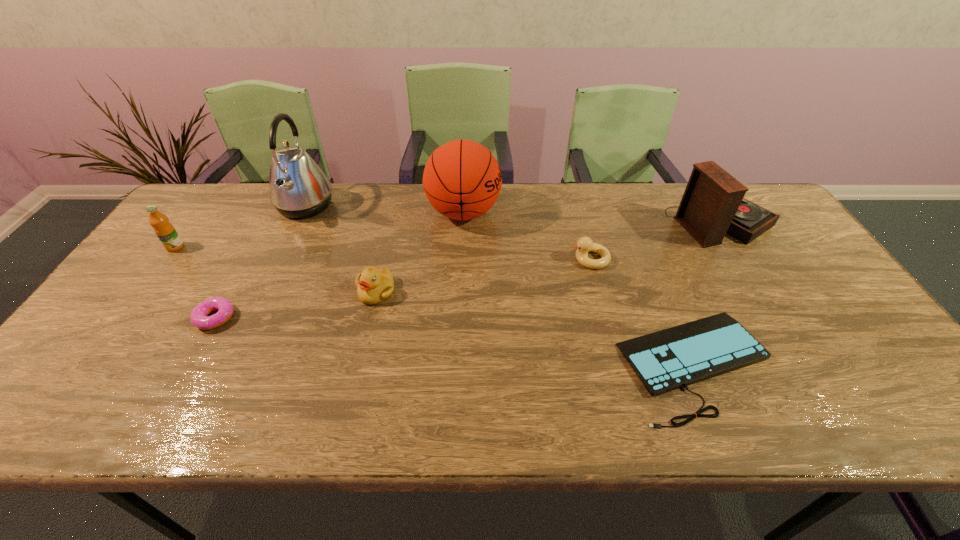
Find the location of a particular element. This screenshot has height=540, width=960. vacant region between the farther duckling and the seventh shortest object is located at coordinates (527, 236).

Find the location of a particular element. This screenshot has width=960, height=540. free area in between the tallest object and the fifth object from left to right is located at coordinates (384, 210).

Choose which object is the third nearest neighbor to the phonograph record. Please provide its 2D coordinates. Your answer should be formatted as a tuple, i.e. [(x, y)], where the tuple contains the x and y coordinates of a point satisfying the conditions above.

[(462, 180)]

At what (x,y) coordinates should I click in order to perform the action: click on object that ranks as the seventh closest to the tallest object. Please return your answer as a coordinate pair (x, y). The width and height of the screenshot is (960, 540). Looking at the image, I should click on (712, 204).

This screenshot has width=960, height=540. In order to click on vacant region that satisfies the following two spatial constraints: 1. on the side with logo of the fifth object from left to right; 2. on the front-facing side of the fourth object from left to right in this screenshot , I will do `click(460, 291)`.

At what (x,y) coordinates should I click in order to perform the action: click on vacant space that satisfies the following two spatial constraints: 1. on the label of the orange juice; 2. on the left side of the shortest object. Please return your answer as a coordinate pair (x, y). Looking at the image, I should click on (88, 364).

Find the location of a particular element. This screenshot has width=960, height=540. free region that satisfies the following two spatial constraints: 1. on the side with logo of the basketball; 2. on the front-facing side of the nearer duckling is located at coordinates (460, 291).

This screenshot has height=540, width=960. I want to click on free space in the image that satisfies the following two spatial constraints: 1. from the spout of the sixth shortest object; 2. on the left side of the kettle, so click(298, 221).

Where is `vacant space that satisfies the following two spatial constraints: 1. on the label of the leftmost object; 2. on the right side of the shortest object`? vacant space that satisfies the following two spatial constraints: 1. on the label of the leftmost object; 2. on the right side of the shortest object is located at coordinates (88, 364).

Locate an element on the screen. This screenshot has width=960, height=540. vacant space that satisfies the following two spatial constraints: 1. on the back side of the shortest object; 2. on the right side of the sixth shortest object is located at coordinates (637, 221).